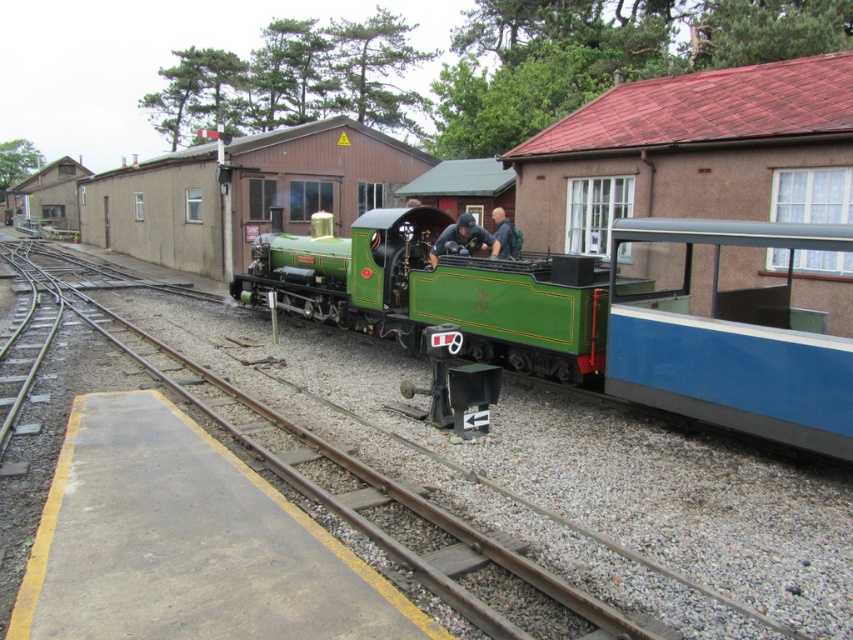
Question: Which point is farther from the camera taking this photo?

Choices:
 (A) (498, 256)
 (B) (349, 461)
 (C) (428, 252)
 (D) (761, 390)

Answer: (C)

Question: Which of these objects is positioned closest to the green polished wood train at center?

Choices:
 (A) matte green locomotive at center
 (B) green polished wood track at center
 (C) dark blue shirt at center

Answer: (A)

Question: Is green polished wood track at center smaller than dark blue shirt at center?

Choices:
 (A) no
 (B) yes

Answer: (A)

Question: Does green polished wood track at center appear on the left side of matte green locomotive at center?

Choices:
 (A) yes
 (B) no

Answer: (A)

Question: Does green polished wood train at center have a larger size compared to dark blue shirt at center?

Choices:
 (A) yes
 (B) no

Answer: (A)

Question: Estimate the real-world distances between objects in this image. Which object is closer to the dark blue shirt at center?

Choices:
 (A) green polished wood train at center
 (B) green polished wood track at center

Answer: (A)